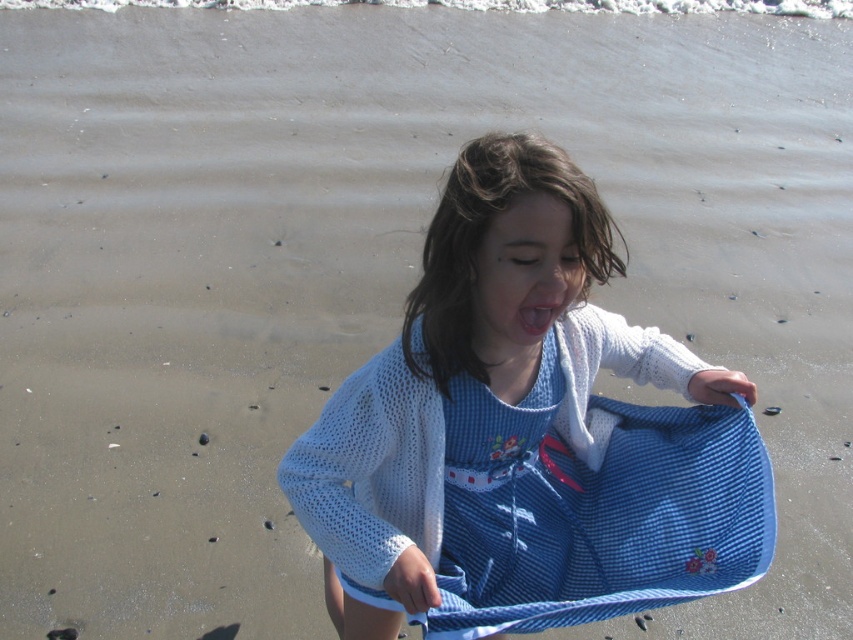
Question: Which point is closer to the camera taking this photo?

Choices:
 (A) (525, 497)
 (B) (524, 314)

Answer: (B)

Question: Is white mesh sweater at center wider than pink glossy lips at center?

Choices:
 (A) yes
 (B) no

Answer: (A)

Question: Is white mesh sweater at center positioned at the back of pink glossy lips at center?

Choices:
 (A) yes
 (B) no

Answer: (B)

Question: Considering the relative positions of white mesh sweater at center and pink glossy lips at center in the image provided, where is white mesh sweater at center located with respect to pink glossy lips at center?

Choices:
 (A) above
 (B) below

Answer: (B)